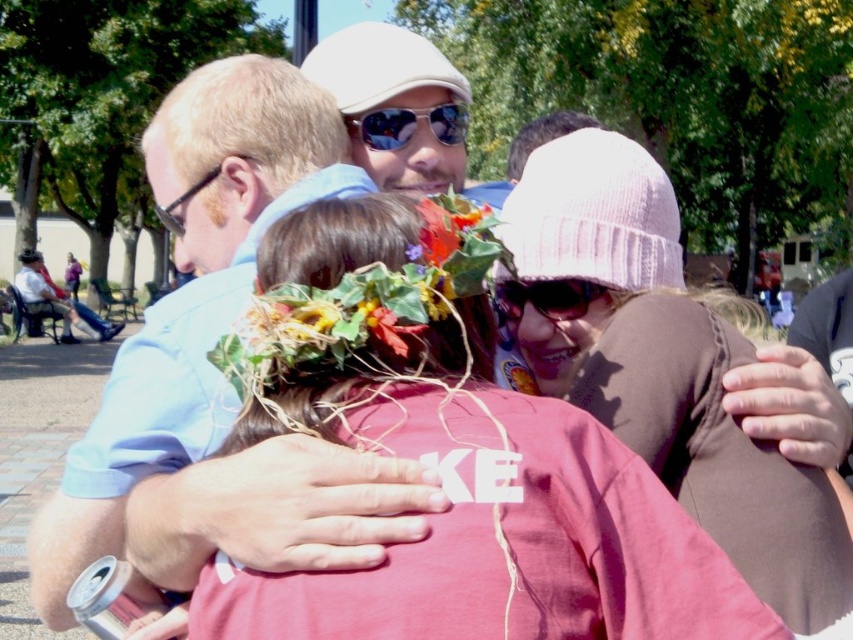
At what (x,y) coordinates should I click in order to perform the action: click on light blue shirt at upper left. Please return your answer as a coordinate pair (x, y). This screenshot has width=853, height=640. Looking at the image, I should click on (190, 296).

Describe the element at coordinates (190, 296) in the screenshot. The width and height of the screenshot is (853, 640). I see `light blue shirt at upper left` at that location.

Find the location of a particular element. light blue shirt at upper left is located at coordinates [x=190, y=296].

Which is more to the left, light blue shirt at left or floral crown at center?

From the viewer's perspective, light blue shirt at left appears more on the left side.

Between light blue shirt at left and floral crown at center, which one is positioned lower?

floral crown at center is below.

The width and height of the screenshot is (853, 640). In order to click on light blue shirt at left in this screenshot , I will do `click(57, 298)`.

Is point (456, 458) positioned before point (85, 308)?

Yes.

Is pink knit hat at center smaller than light blue shirt at left?

No.

You are a GUI agent. You are given a task and a screenshot of the screen. Output one action in this format:
    pyautogui.click(x=<x>, y=<y>)
    Task: Click on the pink knit hat at center
    
    Given the screenshot: What is the action you would take?
    pyautogui.click(x=451, y=458)

At what (x,y) coordinates should I click in order to perform the action: click on pink knit hat at center. Please return your answer as a coordinate pair (x, y). The height and width of the screenshot is (640, 853). Looking at the image, I should click on (451, 458).